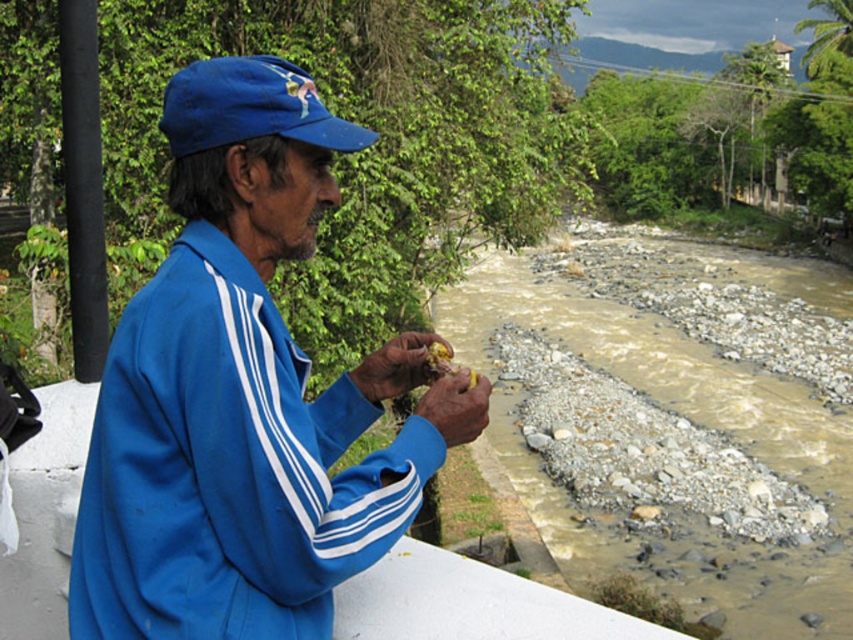
Question: Is blue fabric jacket at left below blue fabric baseball cap at upper left?

Choices:
 (A) yes
 (B) no

Answer: (A)

Question: Which point is farther from the camera taking this photo?

Choices:
 (A) (442, 352)
 (B) (294, 163)
 (C) (350, 145)
 (D) (425, 404)

Answer: (A)

Question: Which of these objects is positioned farthest from the yellow matte fruit at center?

Choices:
 (A) blue fabric baseball cap at upper left
 (B) dry skin at center
 (C) blue fabric jacket at left
 (D) yellow matte food at center

Answer: (A)

Question: Among these objects, which one is farthest from the camera?

Choices:
 (A) blue fabric jacket at left
 (B) blue fabric baseball cap at upper left
 (C) dry skin at center

Answer: (C)

Question: Is dry skin at center bigger than yellow matte food at center?

Choices:
 (A) no
 (B) yes

Answer: (B)

Question: Is blue fabric jacket at left to the right of blue fabric baseball cap at upper left from the viewer's perspective?

Choices:
 (A) yes
 (B) no

Answer: (B)